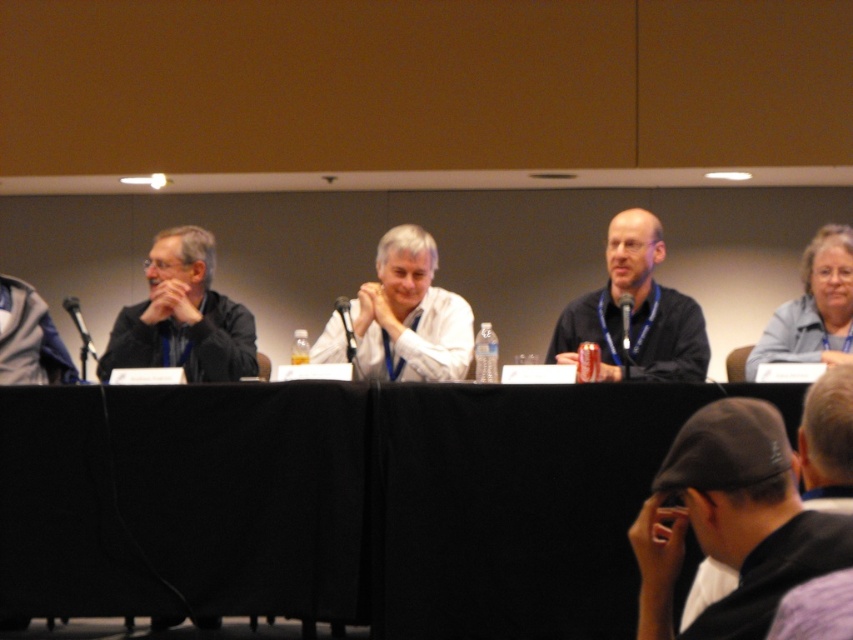
You are attending a panel discussion and notice two shirts at the center of the table. The matte black shirt at center and the white matte shirt at center. Which shirt is positioned to the right of the other?

The matte black shirt at center is to the right of the white matte shirt at center.

You are sitting at the back of the room and want to see both the white matte shirt at center and the gray fabric jacket at upper right. Which one will appear closer to you?

The white matte shirt at center will appear closer to you because it is further to the viewer than the gray fabric jacket at upper right.

You are organizing a photo shoot and need to place a small decorative item between the matte black shirt at center and the white matte shirt at center. Which shirt should you place it closer to if the item can only fit in the space where the shirts are closest to each other?

The item should be placed closer to the white matte shirt at center because the matte black shirt at center is bigger and thus farther away from the white matte shirt at center, making the closest point between them near the smaller white matte shirt.